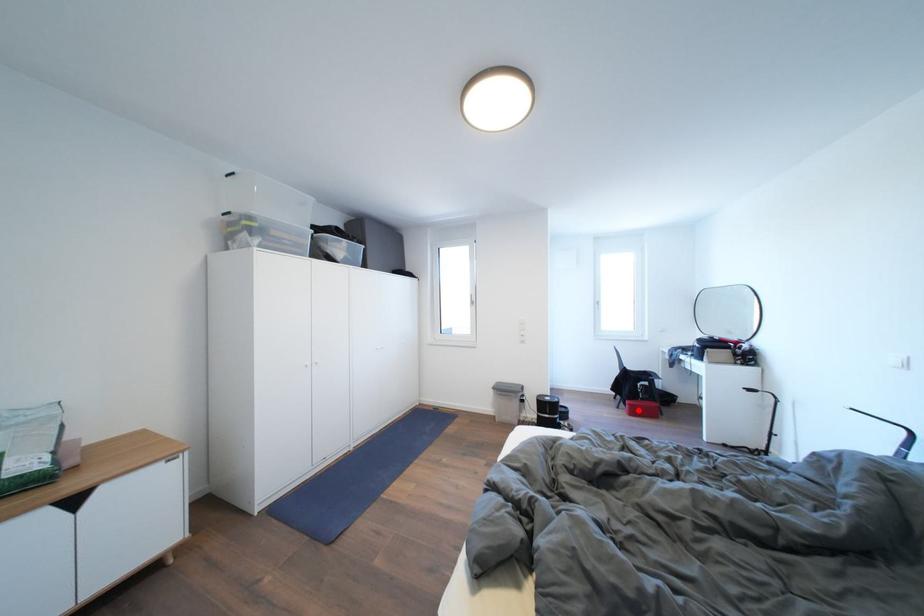
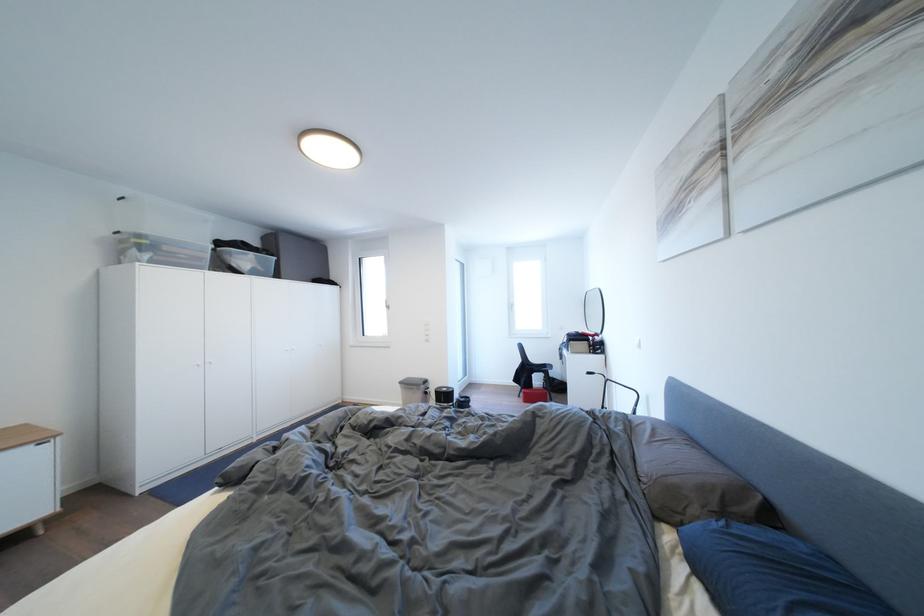
Where in the second image is the point corresponding to the highlighted location from the first image?

(532, 398)